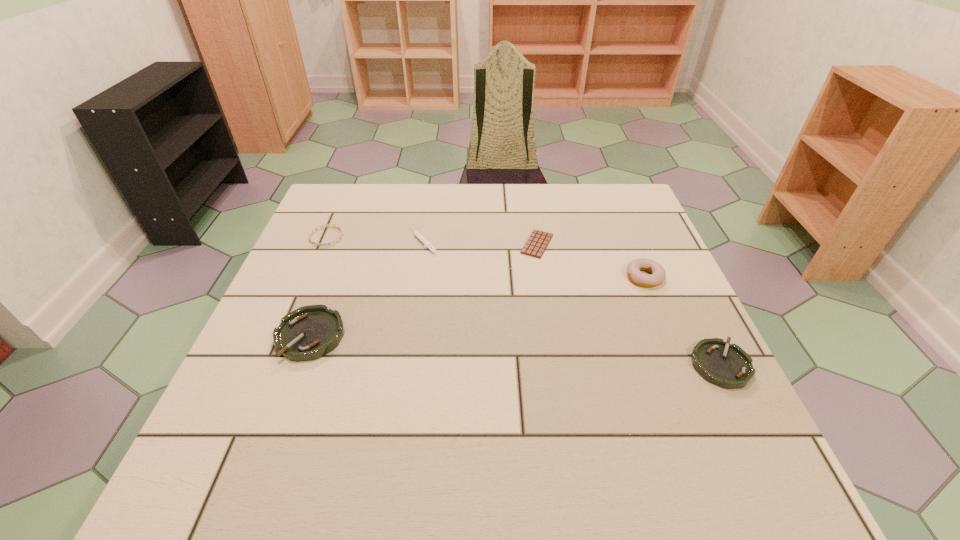
You are a GUI agent. You are given a task and a screenshot of the screen. Output one action in this format:
    pyautogui.click(x=<x>, y=<y>)
    Task: Click on the vacant space located on the surface of the bracelet showing star-shaped elements
    Image resolution: width=960 pixels, height=540 pixels.
    Given the screenshot: What is the action you would take?
    pyautogui.click(x=309, y=278)

The image size is (960, 540). I want to click on free space located on the right of the fourth object from right to left, so click(483, 241).

This screenshot has height=540, width=960. What are the coordinates of `free space located 0.370m on the front of the candy bar` in the screenshot? It's located at (559, 381).

The image size is (960, 540). In order to click on vacant space located 0.210m on the left of the fourth farthest object in this screenshot , I will do `click(540, 277)`.

Find the location of a particular element. The height and width of the screenshot is (540, 960). bracelet situated at the far edge is located at coordinates (335, 225).

Where is `syringe present at the far edge`? The height and width of the screenshot is (540, 960). syringe present at the far edge is located at coordinates (427, 244).

Find the location of `ashtray situated at the left edge`. ashtray situated at the left edge is located at coordinates (308, 333).

You are a GUI agent. You are given a task and a screenshot of the screen. Output one action in this format:
    pyautogui.click(x=<x>, y=<y>)
    Task: Click on the bracelet that is at the left edge
    The image size is (960, 540).
    Given the screenshot: What is the action you would take?
    pyautogui.click(x=335, y=225)

The width and height of the screenshot is (960, 540). In order to click on ashtray at the right edge in this screenshot , I will do `click(726, 365)`.

Locate an element on the screen. doughnut that is positioned at the right edge is located at coordinates (658, 274).